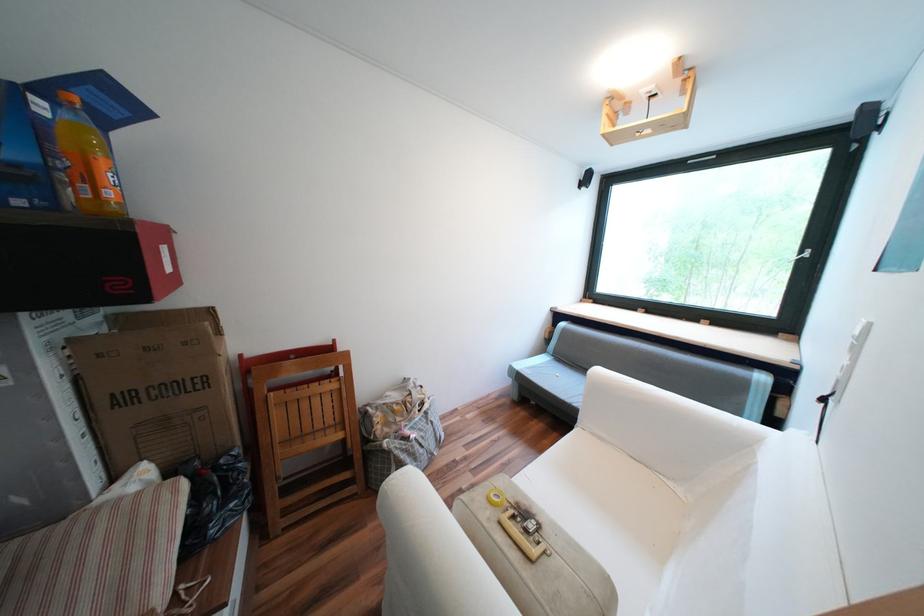
What do you see at coordinates (432, 556) in the screenshot?
I see `the white sofa armrest` at bounding box center [432, 556].